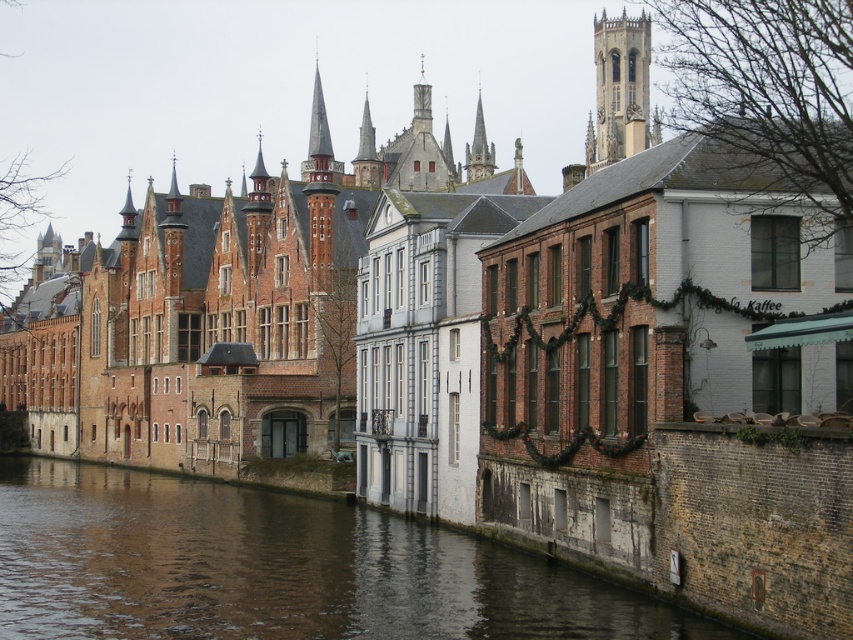
Is brown brick wall at lower right to the right of smooth gray stone spire at center from the viewer's perspective?

Incorrect, brown brick wall at lower right is not on the right side of smooth gray stone spire at center.

Consider the image. Does brown brick wall at lower right appear under smooth gray stone spire at center?

Correct, brown brick wall at lower right is located below smooth gray stone spire at center.

Is point (189, 627) closer to camera compared to point (486, 147)?

Yes.

Locate an element on the screen. The width and height of the screenshot is (853, 640). brown brick wall at lower right is located at coordinates (277, 568).

Is point (132, 596) positioned behind point (636, 106)?

No, it is in front of (636, 106).

Can you confirm if brown brick wall at lower right is positioned below stone clock tower at upper right?

Indeed, brown brick wall at lower right is positioned under stone clock tower at upper right.

Who is more forward, [520,564] or [598,125]?

Point [520,564] is more forward.

The image size is (853, 640). What are the coordinates of `brown brick wall at lower right` in the screenshot? It's located at (277, 568).

Does brown brick wall at lower right appear on the left side of gray stone tower at center?

Indeed, brown brick wall at lower right is positioned on the left side of gray stone tower at center.

At what (x,y) coordinates should I click in order to perform the action: click on brown brick wall at lower right. Please return your answer as a coordinate pair (x, y). Looking at the image, I should click on (277, 568).

Image resolution: width=853 pixels, height=640 pixels. I want to click on brown brick wall at lower right, so (277, 568).